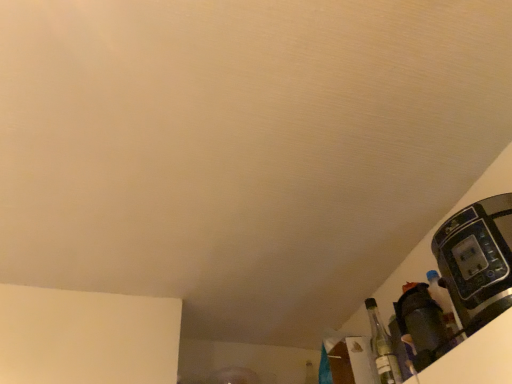
Question: Is black plastic coffee machine at right turned away from matte black coffee maker at lower right?

Choices:
 (A) yes
 (B) no

Answer: (B)

Question: Considering the relative sizes of black plastic coffee machine at right and matte black coffee maker at lower right in the image provided, is black plastic coffee machine at right shorter than matte black coffee maker at lower right?

Choices:
 (A) yes
 (B) no

Answer: (B)

Question: Can you confirm if black plastic coffee machine at right is positioned to the right of matte black coffee maker at lower right?

Choices:
 (A) no
 (B) yes

Answer: (B)

Question: Considering the relative sizes of black plastic coffee machine at right and matte black coffee maker at lower right in the image provided, is black plastic coffee machine at right taller than matte black coffee maker at lower right?

Choices:
 (A) yes
 (B) no

Answer: (A)

Question: From a real-world perspective, is black plastic coffee machine at right physically below matte black coffee maker at lower right?

Choices:
 (A) no
 (B) yes

Answer: (B)

Question: Is black plastic coffee machine at right wider than matte black coffee maker at lower right?

Choices:
 (A) no
 (B) yes

Answer: (B)

Question: From a real-world perspective, is matte black coffee maker at lower right positioned over black plastic coffee machine at right based on gravity?

Choices:
 (A) yes
 (B) no

Answer: (A)

Question: Is matte black coffee maker at lower right at the left side of black plastic coffee machine at right?

Choices:
 (A) yes
 (B) no

Answer: (A)

Question: Is black plastic coffee machine at right located within matte black coffee maker at lower right?

Choices:
 (A) yes
 (B) no

Answer: (B)

Question: Is the surface of matte black coffee maker at lower right in direct contact with black plastic coffee machine at right?

Choices:
 (A) no
 (B) yes

Answer: (A)

Question: Is matte black coffee maker at lower right at the right side of black plastic coffee machine at right?

Choices:
 (A) no
 (B) yes

Answer: (A)

Question: Does matte black coffee maker at lower right have a greater height compared to black plastic coffee machine at right?

Choices:
 (A) no
 (B) yes

Answer: (A)

Question: Is clear glass bottle at lower right positioned beyond the bounds of matte black coffee maker at lower right?

Choices:
 (A) yes
 (B) no

Answer: (A)